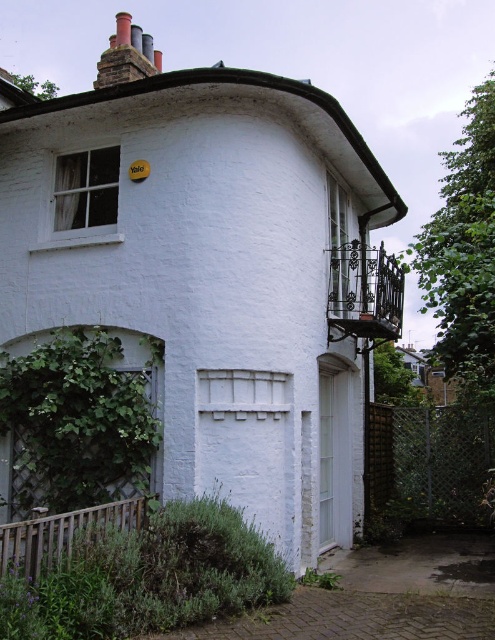
Question: Is green leafy ivy at lower left closer to the viewer compared to smooth brick chimney at upper left?

Choices:
 (A) no
 (B) yes

Answer: (B)

Question: Which point appears closest to the camera in this image?

Choices:
 (A) (x=127, y=13)
 (B) (x=110, y=452)

Answer: (B)

Question: Which object appears closest to the camera in this image?

Choices:
 (A) smooth brick chimney at upper left
 (B) green leafy ivy at lower left

Answer: (B)

Question: Does green leafy ivy at lower left appear on the right side of green leafy ivy at upper right?

Choices:
 (A) no
 (B) yes

Answer: (A)

Question: Is green leafy ivy at upper right above smooth brick chimney at upper left?

Choices:
 (A) yes
 (B) no

Answer: (B)

Question: Among these objects, which one is farthest from the camera?

Choices:
 (A) smooth brick chimney at upper left
 (B) green leafy ivy at upper right
 (C) green leafy ivy at lower left

Answer: (A)